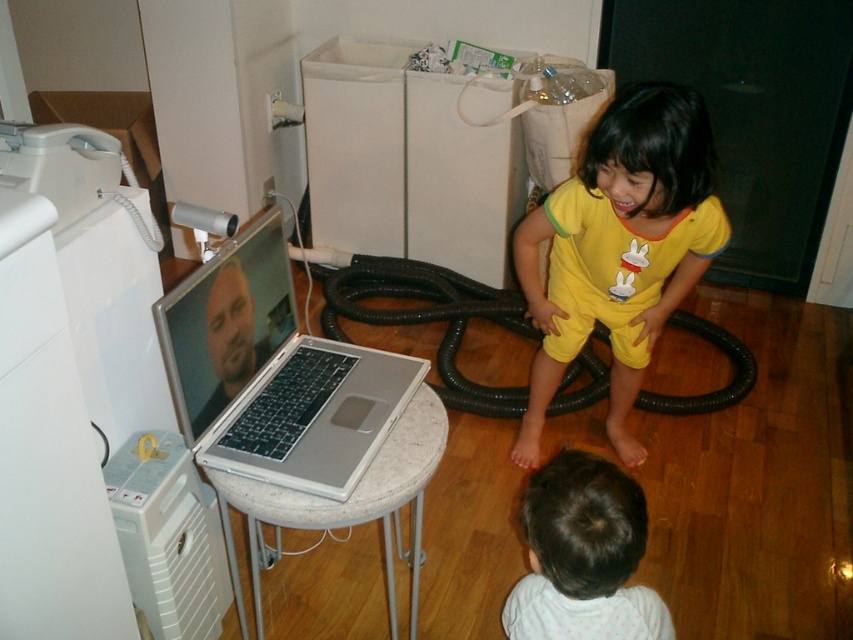
Question: Where is silver metallic laptop at center located in relation to silver metallic stool at center in the image?

Choices:
 (A) left
 (B) right

Answer: (A)

Question: Which point is farther to the camera?

Choices:
 (A) silver metallic stool at center
 (B) light brown hair at lower center
 (C) yellow cotton onesie at center
 (D) silver metallic laptop at center

Answer: (C)

Question: Is yellow cotton onesie at center below silver metallic stool at center?

Choices:
 (A) yes
 (B) no

Answer: (B)

Question: Estimate the real-world distances between objects in this image. Which object is closer to the silver metallic laptop at center?

Choices:
 (A) light brown hair at lower center
 (B) yellow cotton onesie at center
 (C) silver metallic stool at center

Answer: (C)

Question: Among these points, which one is farthest from the camera?

Choices:
 (A) (195, 362)
 (B) (540, 481)
 (C) (387, 579)
 (D) (677, 204)

Answer: (C)

Question: Is light brown hair at lower center in front of silver metallic stool at center?

Choices:
 (A) no
 (B) yes

Answer: (B)